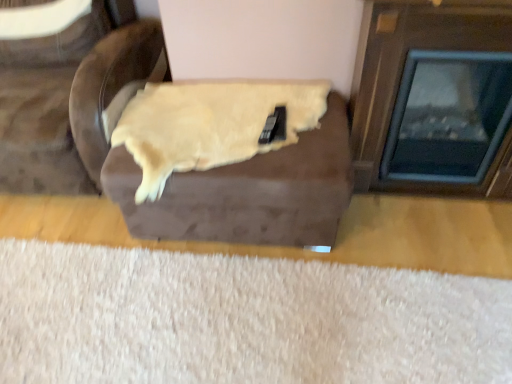
What do you see at coordinates (42, 113) in the screenshot? I see `brown suede armchair at upper left, the 2th furniture viewed from the right` at bounding box center [42, 113].

Identify the location of brown suede armchair at upper left, acting as the first furniture starting from the left. (42, 113).

Where is `brown suede armchair at upper left, acting as the first furniture starting from the left`? The height and width of the screenshot is (384, 512). brown suede armchair at upper left, acting as the first furniture starting from the left is located at coordinates (42, 113).

Is white fluffy rug at lower center turned away from brown suede ottoman at center, the first furniture when ordered from right to left?

No, white fluffy rug at lower center's orientation is not away from brown suede ottoman at center, the first furniture when ordered from right to left.

Locate an element on the screen. The height and width of the screenshot is (384, 512). mat in front of the brown suede ottoman at center, the second furniture in the left-to-right sequence is located at coordinates (242, 320).

In the image, is white fluffy rug at lower center positioned in front of or behind brown suede ottoman at center, the first furniture when ordered from right to left?

white fluffy rug at lower center is positioned closer to the viewer than brown suede ottoman at center, the first furniture when ordered from right to left.

How many degrees apart are the facing directions of white fluffy rug at lower center and brown suede ottoman at center, the second furniture in the left-to-right sequence?

white fluffy rug at lower center and brown suede ottoman at center, the second furniture in the left-to-right sequence, are facing 88.6 degrees away from each other.

Is wooden fireplace at right positioned with its back to white fluffy rug at lower center?

That's not correct — wooden fireplace at right is not looking away from white fluffy rug at lower center.

Does wooden fireplace at right have a greater width compared to white fluffy rug at lower center?

Incorrect, the width of wooden fireplace at right does not surpass that of white fluffy rug at lower center.

Is wooden fireplace at right positioned before white fluffy rug at lower center?

No, it is not.

Which of these two, wooden fireplace at right or white fluffy rug at lower center, stands taller?

wooden fireplace at right.

In the image, is brown suede armchair at upper left, the 2th furniture viewed from the right, positioned in front of or behind wooden fireplace at right?

Visually, brown suede armchair at upper left, the 2th furniture viewed from the right, is located behind wooden fireplace at right.

Measure the distance between brown suede armchair at upper left, acting as the first furniture starting from the left, and wooden fireplace at right.

5.20 feet.

Is brown suede armchair at upper left, the 2th furniture viewed from the right, shorter than wooden fireplace at right?

In fact, brown suede armchair at upper left, the 2th furniture viewed from the right, may be taller than wooden fireplace at right.

Is brown suede armchair at upper left, acting as the first furniture starting from the left, far from wooden fireplace at right?

Yes, brown suede armchair at upper left, acting as the first furniture starting from the left, is far from wooden fireplace at right.

From the image's perspective, which object appears higher, wooden fireplace at right or brown suede ottoman at center, the first furniture when ordered from right to left?

wooden fireplace at right appears higher in the image.

You are a GUI agent. You are given a task and a screenshot of the screen. Output one action in this format:
    pyautogui.click(x=<x>, y=<y>)
    Task: Click on the fireplace that appears in front of the brown suede ottoman at center, the first furniture when ordered from right to left
    This screenshot has height=384, width=512.
    Given the screenshot: What is the action you would take?
    pyautogui.click(x=448, y=116)

Who is bigger, wooden fireplace at right or brown suede ottoman at center, the first furniture when ordered from right to left?

brown suede ottoman at center, the first furniture when ordered from right to left.

From a real-world perspective, is brown suede armchair at upper left, acting as the first furniture starting from the left, located higher than brown suede ottoman at center, the first furniture when ordered from right to left?

Yes.

Is brown suede armchair at upper left, acting as the first furniture starting from the left, thinner than brown suede ottoman at center, the first furniture when ordered from right to left?

No.

Can you confirm if brown suede armchair at upper left, the 2th furniture viewed from the right, is taller than brown suede ottoman at center, the first furniture when ordered from right to left?

Correct, brown suede armchair at upper left, the 2th furniture viewed from the right, is much taller as brown suede ottoman at center, the first furniture when ordered from right to left.

Considering the relative positions of brown suede armchair at upper left, acting as the first furniture starting from the left, and brown suede ottoman at center, the second furniture in the left-to-right sequence, in the image provided, is brown suede armchair at upper left, acting as the first furniture starting from the left, to the left of brown suede ottoman at center, the second furniture in the left-to-right sequence, from the viewer's perspective?

Indeed, brown suede armchair at upper left, acting as the first furniture starting from the left, is positioned on the left side of brown suede ottoman at center, the second furniture in the left-to-right sequence.

Who is taller, white fluffy rug at lower center or brown suede armchair at upper left, the 2th furniture viewed from the right?

brown suede armchair at upper left, the 2th furniture viewed from the right, is taller.

Is white fluffy rug at lower center aimed at brown suede armchair at upper left, acting as the first furniture starting from the left?

No, white fluffy rug at lower center is not facing towards brown suede armchair at upper left, acting as the first furniture starting from the left.

From the image's perspective, which furniture is the 2nd one above the white fluffy rug at lower center? Please provide its 2D coordinates.

[(42, 113)]

You are a GUI agent. You are given a task and a screenshot of the screen. Output one action in this format:
    pyautogui.click(x=<x>, y=<y>)
    Task: Click on the 1st furniture counting from the left of the wooden fireplace at right
    The height and width of the screenshot is (384, 512).
    Given the screenshot: What is the action you would take?
    pyautogui.click(x=212, y=169)

From the image's perspective, is brown suede ottoman at center, the second furniture in the left-to-right sequence, on top of wooden fireplace at right?

Actually, brown suede ottoman at center, the second furniture in the left-to-right sequence, appears below wooden fireplace at right in the image.

Is point (290, 175) more distant than point (401, 145)?

That is False.

I want to click on furniture to the right of white fluffy rug at lower center, so click(212, 169).

In the image, there is a wooden fireplace at right. Identify the location of mat below it (from a real-world perspective). Image resolution: width=512 pixels, height=384 pixels. (242, 320).

Based on their spatial positions, is brown suede ottoman at center, the first furniture when ordered from right to left, or brown suede armchair at upper left, the 2th furniture viewed from the right, closer to wooden fireplace at right?

brown suede ottoman at center, the first furniture when ordered from right to left.

Estimate the real-world distances between objects in this image. Which object is closer to brown suede armchair at upper left, the 2th furniture viewed from the right, brown suede ottoman at center, the first furniture when ordered from right to left, or white fluffy rug at lower center?

The object closer to brown suede armchair at upper left, the 2th furniture viewed from the right, is brown suede ottoman at center, the first furniture when ordered from right to left.

From the image, which object appears to be farther from brown suede armchair at upper left, acting as the first furniture starting from the left, white fluffy rug at lower center or brown suede ottoman at center, the first furniture when ordered from right to left?

Among the two, white fluffy rug at lower center is located further to brown suede armchair at upper left, acting as the first furniture starting from the left.

Based on their spatial positions, is wooden fireplace at right or brown suede armchair at upper left, acting as the first furniture starting from the left, further from white fluffy rug at lower center?

Among the two, brown suede armchair at upper left, acting as the first furniture starting from the left, is located further to white fluffy rug at lower center.

Looking at the image, which one is located further to brown suede armchair at upper left, acting as the first furniture starting from the left, brown suede ottoman at center, the first furniture when ordered from right to left, or wooden fireplace at right?

wooden fireplace at right is positioned further to the anchor brown suede armchair at upper left, acting as the first furniture starting from the left.

In the scene shown: Considering their positions, is brown suede armchair at upper left, the 2th furniture viewed from the right, positioned closer to brown suede ottoman at center, the second furniture in the left-to-right sequence, than white fluffy rug at lower center?

The object closer to brown suede ottoman at center, the second furniture in the left-to-right sequence, is brown suede armchair at upper left, the 2th furniture viewed from the right.

Considering their positions, is white fluffy rug at lower center positioned closer to wooden fireplace at right than brown suede armchair at upper left, the 2th furniture viewed from the right?

white fluffy rug at lower center lies closer to wooden fireplace at right than the other object.

Which object lies nearer to the anchor point wooden fireplace at right, brown suede ottoman at center, the first furniture when ordered from right to left, or white fluffy rug at lower center?

Among the two, brown suede ottoman at center, the first furniture when ordered from right to left, is located nearer to wooden fireplace at right.

Where is `furniture situated between brown suede armchair at upper left, acting as the first furniture starting from the left, and wooden fireplace at right from left to right`? The image size is (512, 384). furniture situated between brown suede armchair at upper left, acting as the first furniture starting from the left, and wooden fireplace at right from left to right is located at coordinates (212, 169).

You are a GUI agent. You are given a task and a screenshot of the screen. Output one action in this format:
    pyautogui.click(x=<x>, y=<y>)
    Task: Click on the mat situated between brown suede armchair at upper left, the 2th furniture viewed from the right, and wooden fireplace at right from left to right
    The image size is (512, 384).
    Given the screenshot: What is the action you would take?
    pyautogui.click(x=242, y=320)

Where is `mat situated between brown suede armchair at upper left, acting as the first furniture starting from the left, and brown suede ottoman at center, the first furniture when ordered from right to left, from left to right`? The width and height of the screenshot is (512, 384). mat situated between brown suede armchair at upper left, acting as the first furniture starting from the left, and brown suede ottoman at center, the first furniture when ordered from right to left, from left to right is located at coordinates (242, 320).

Locate an element on the screen. The width and height of the screenshot is (512, 384). furniture situated between white fluffy rug at lower center and wooden fireplace at right from left to right is located at coordinates (212, 169).